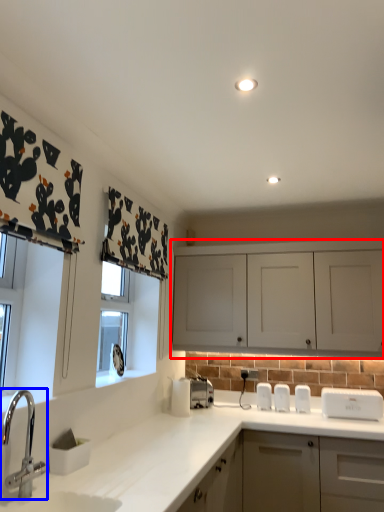
Question: Which point is further to the camera, cabinetry (highlighted by a red box) or tap (highlighted by a blue box)?

Choices:
 (A) cabinetry
 (B) tap

Answer: (A)